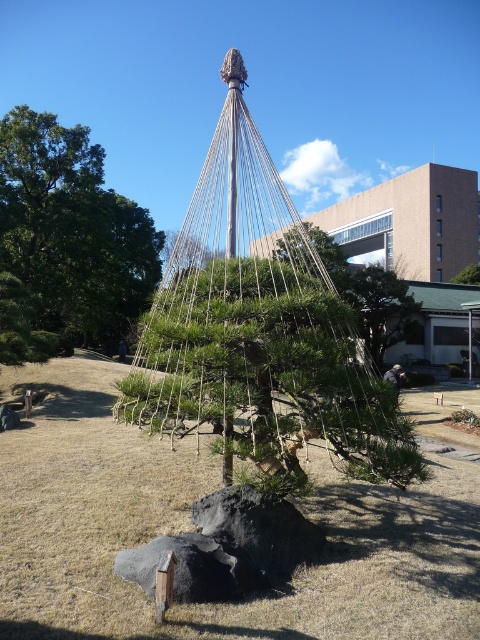
You are a landscape architect designing a garden and want to place a black rough rock at center and a green leafy tree at center. Given that the minimum spacing requirement between any two garden elements is 50 meters, will this placement meet the requirement?

The black rough rock at center and green leafy tree at center are 50.97 meters apart from each other, which exceeds the 50 meters minimum spacing requirement, so the placement meets the requirement.

Based on the photo, you are a visitor at this bonsai exhibit and want to take a photo of both the green matte pine at center and the green leafy tree at center. Since you want them both in focus, you need to know which one is closer to you. Which tree is closer?

The green matte pine at center is closer to the viewer than the green leafy tree at center, so you should focus on the green matte pine at center to ensure both are in focus.